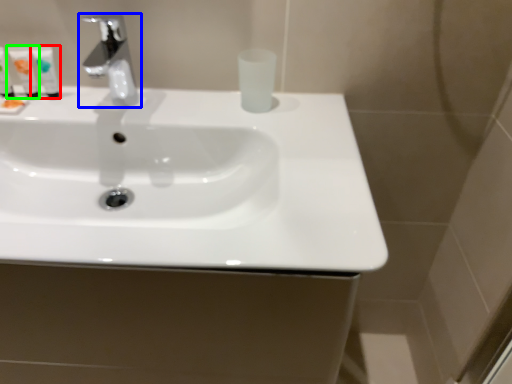
Question: Estimate the real-world distances between objects in this image. Which object is closer to mouthwash (highlighted by a red box), tap (highlighted by a blue box) or mouthwash (highlighted by a green box)?

Choices:
 (A) tap
 (B) mouthwash

Answer: (B)